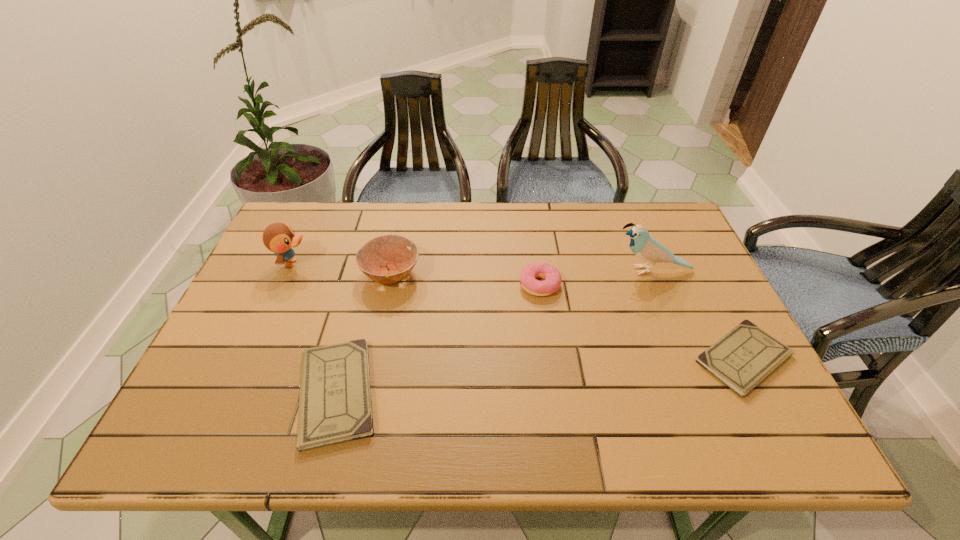
Where is `blank space located 0.200m on the back of the second shortest object`? The height and width of the screenshot is (540, 960). blank space located 0.200m on the back of the second shortest object is located at coordinates (365, 285).

You are a GUI agent. You are given a task and a screenshot of the screen. Output one action in this format:
    pyautogui.click(x=<x>, y=<y>)
    Task: Click on the blank space located 0.140m on the back of the shortest object
    This screenshot has height=540, width=960.
    Given the screenshot: What is the action you would take?
    pyautogui.click(x=705, y=284)

You are a GUI agent. You are given a task and a screenshot of the screen. Output one action in this format:
    pyautogui.click(x=<x>, y=<y>)
    Task: Click on the vacant region located on the front of the third object from right to left
    Image resolution: width=960 pixels, height=540 pixels.
    Given the screenshot: What is the action you would take?
    pyautogui.click(x=556, y=401)

Identify the location of blank space located 0.140m at the face of the tallest object. Image resolution: width=960 pixels, height=540 pixels. (562, 271).

Where is `free space located at the face of the tallest object`? The image size is (960, 540). free space located at the face of the tallest object is located at coordinates (502, 271).

This screenshot has height=540, width=960. Identify the location of free space located at the face of the tallest object. (523, 271).

The height and width of the screenshot is (540, 960). In order to click on free space located 0.050m on the right of the bowl in this screenshot , I will do tap(439, 274).

Identify the location of vacant space located 0.130m on the front-facing side of the fifth shortest object. This screenshot has width=960, height=540. (356, 263).

Identify the location of object that is at the left edge. (279, 238).

Locate an element on the screen. checkbook that is positioned at the right edge is located at coordinates (744, 357).